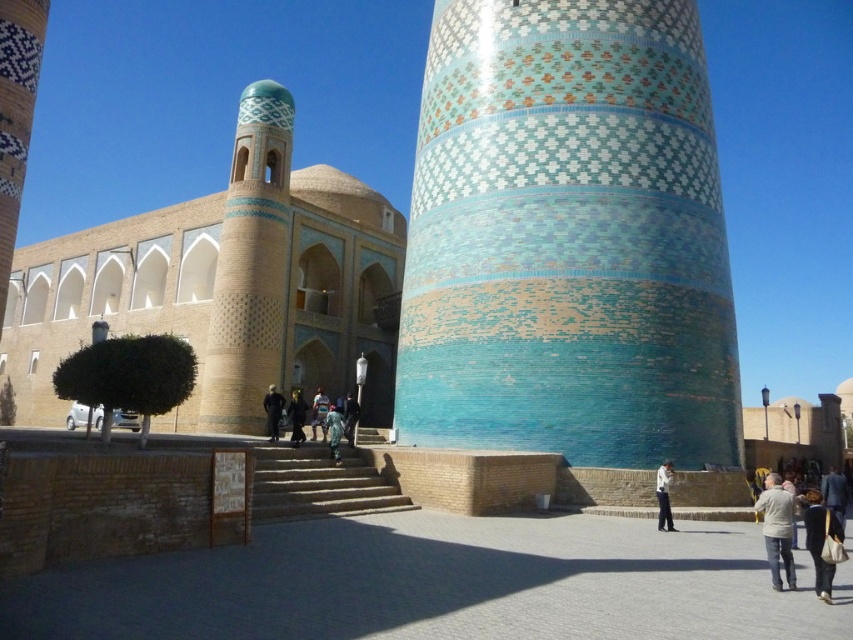
Based on the photo, you are a visitor at this historical site and want to take a photo of both the dark blue suit at lower right and the green fabric dress at center. Which of the two should you focus on first to ensure they are both in the frame?

The dark blue suit at lower right is taller than the green fabric dress at center, so you should focus on the dark blue suit at lower right first to ensure both are in the frame.

You are standing at the point marked as point (567, 237) in the image. What structure is directly beneath your feet?

The point (567, 237) is directly beneath the glazed ceramic tower at center.

You are a photographer planning to capture both the dark blue suit at lower right and the green fabric dress at center in a single frame. Which clothing item will appear bigger in the photo?

The dark blue suit at lower right will appear bigger in the photo because it is larger in size than the green fabric dress at center.